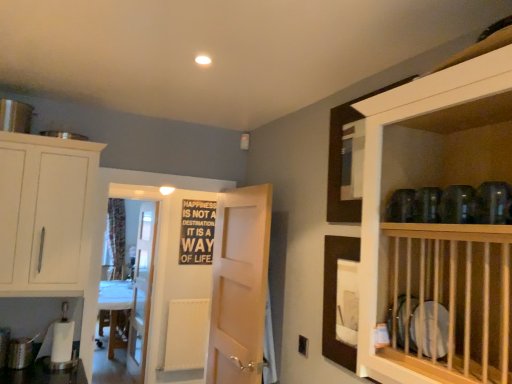
Question: Can you confirm if white wood cabinet at left is positioned to the left of floral fabric curtain at left?

Choices:
 (A) yes
 (B) no

Answer: (B)

Question: Considering the relative sizes of white wood cabinet at left and floral fabric curtain at left in the image provided, is white wood cabinet at left wider than floral fabric curtain at left?

Choices:
 (A) no
 (B) yes

Answer: (B)

Question: From a real-world perspective, is white wood cabinet at left located beneath floral fabric curtain at left?

Choices:
 (A) yes
 (B) no

Answer: (B)

Question: Considering the relative positions of white wood cabinet at left and floral fabric curtain at left in the image provided, is white wood cabinet at left to the right of floral fabric curtain at left from the viewer's perspective?

Choices:
 (A) no
 (B) yes

Answer: (B)

Question: Is white wood cabinet at left oriented towards floral fabric curtain at left?

Choices:
 (A) no
 (B) yes

Answer: (A)

Question: Is point (155, 213) closer or farther from the camera than point (123, 322)?

Choices:
 (A) closer
 (B) farther

Answer: (A)

Question: From a real-world perspective, is white wooden door at center, the 2th door in the right-to-left sequence, positioned above or below white glossy table at center?

Choices:
 (A) above
 (B) below

Answer: (A)

Question: Considering the positions of white wooden door at center, the first door viewed from the left, and white glossy table at center in the image, is white wooden door at center, the first door viewed from the left, bigger or smaller than white glossy table at center?

Choices:
 (A) small
 (B) big

Answer: (A)

Question: Looking at their shapes, would you say white wooden door at center, the first door viewed from the left, is wider or thinner than white glossy table at center?

Choices:
 (A) wide
 (B) thin

Answer: (B)

Question: Considering the positions of white glossy table at center and floral fabric curtain at left in the image, is white glossy table at center bigger or smaller than floral fabric curtain at left?

Choices:
 (A) small
 (B) big

Answer: (B)

Question: Considering the positions of white glossy table at center and floral fabric curtain at left in the image, is white glossy table at center taller or shorter than floral fabric curtain at left?

Choices:
 (A) short
 (B) tall

Answer: (A)

Question: Looking at their shapes, would you say white glossy table at center is wider or thinner than floral fabric curtain at left?

Choices:
 (A) thin
 (B) wide

Answer: (B)

Question: From a real-world perspective, is white glossy table at center physically located above or below floral fabric curtain at left?

Choices:
 (A) below
 (B) above

Answer: (A)

Question: Looking at their shapes, would you say floral fabric curtain at left is wider or thinner than white wooden door at center, which appears as the first door when viewed from the right?

Choices:
 (A) wide
 (B) thin

Answer: (A)

Question: Is point (112, 221) positioned closer to the camera than point (217, 236)?

Choices:
 (A) closer
 (B) farther

Answer: (B)